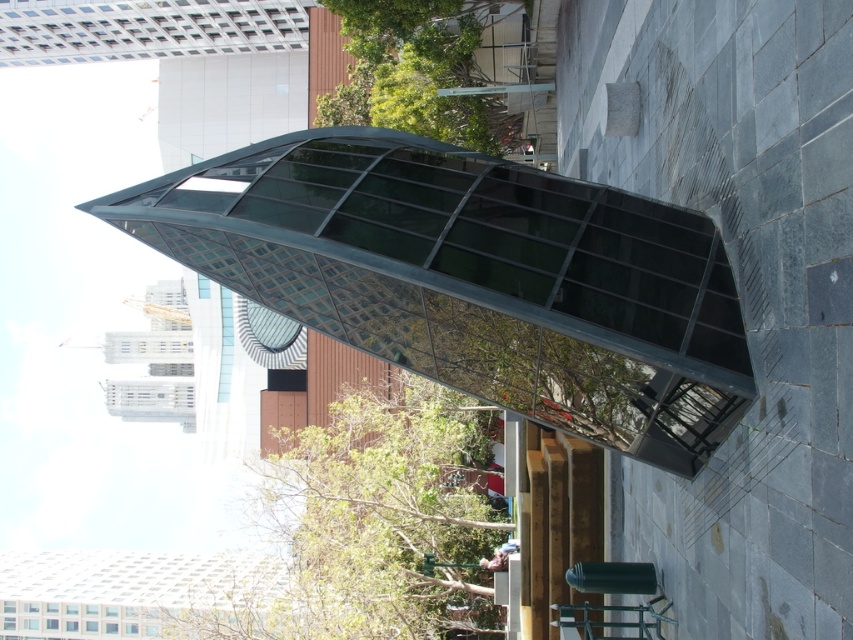
Is point (698, 253) closer to viewer compared to point (602, 576)?

Yes.

Locate an element on the screen. transparent glass canopy at center is located at coordinates (473, 276).